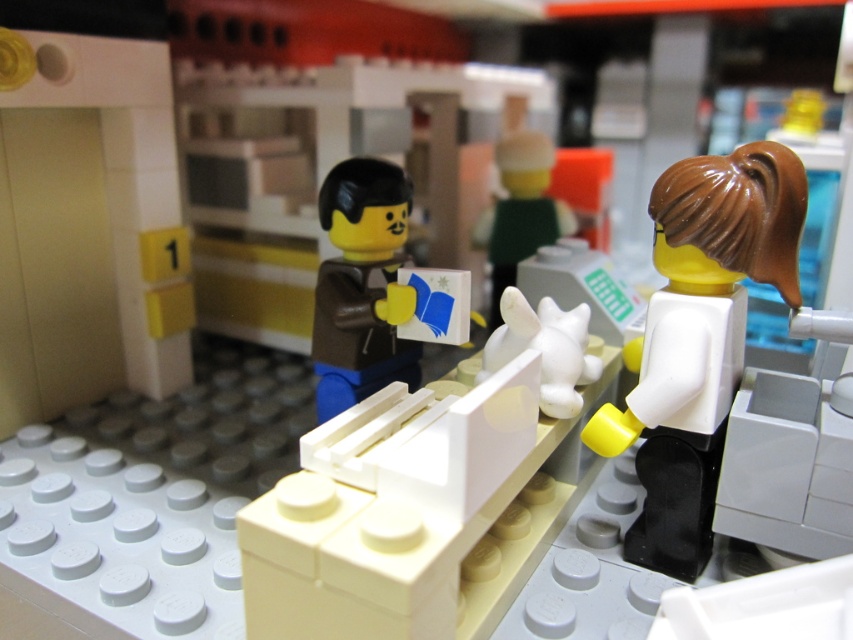
Consider the image. You are a customer in a store and need to place an order. You see the brown matte jacket at center and the white matte cat at center. Which item can you fit into a box that is 10 cm wide?

The brown matte jacket at center has a width less than the white matte cat at center, so the brown matte jacket at center can fit into the 10 cm wide box if the cat is wider than 10 cm. However, without knowing the exact width of the cat, it is uncertain. Please check the actual dimensions.

From the picture: You are a delivery robot in a LEGO scene. You need to deliver a package to the white matte rabbit at center. The robot has a maximum reach of 50 centimeters. There is a white matte figure at right in the way. Can you reach the rabbit without moving the figure?

The white matte figure at right and white matte rabbit at center are 58.79 centimeters apart. Since the robot can only reach 50 centimeters, it cannot reach the rabbit without moving the figure.

You are a customer in this LEGO scene and want to see the cat behind the counter. Can you see the white matte cat at center from where the white matte figure at right is standing?

Yes, the white matte figure at right is in front of the white matte cat at center, so the cat is directly behind the figure, making it visible from the figure at right.